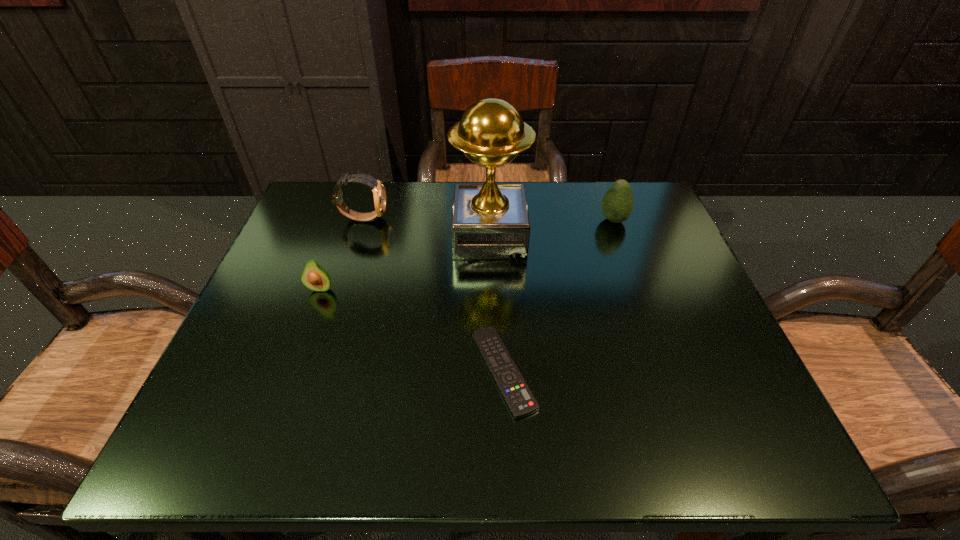
This screenshot has height=540, width=960. I want to click on free space between the farther avocado and the award, so click(552, 228).

At what (x,y) coordinates should I click in order to perform the action: click on free spot between the nearer avocado and the remote control. Please return your answer as a coordinate pair (x, y). Looking at the image, I should click on (412, 329).

The image size is (960, 540). In order to click on empty space that is in between the watch and the shortest object in this screenshot , I will do `click(433, 294)`.

The image size is (960, 540). What are the coordinates of `blank region between the fourth farthest object and the watch` in the screenshot? It's located at (342, 253).

Identify the location of vacant area that lies between the award and the fourth tallest object. This screenshot has height=540, width=960. (405, 262).

This screenshot has width=960, height=540. What are the coordinates of `free point between the tallest object and the remote control` in the screenshot? It's located at (496, 303).

Where is `free space between the tallest object and the watch`? Image resolution: width=960 pixels, height=540 pixels. free space between the tallest object and the watch is located at coordinates (426, 227).

Identify the location of unoccupied area between the award and the watch. (426, 227).

This screenshot has height=540, width=960. I want to click on empty space between the tallest object and the taller avocado, so click(552, 228).

Locate an element on the screen. This screenshot has width=960, height=540. object identified as the closest to the fourth farthest object is located at coordinates (379, 194).